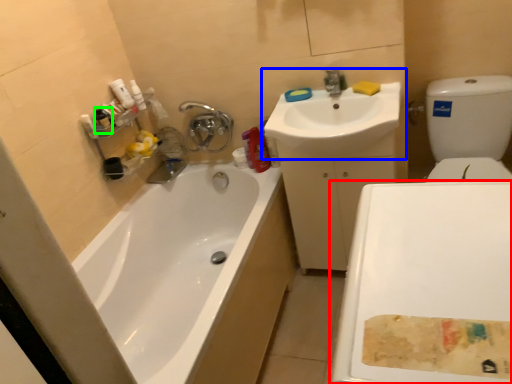
Question: Based on their relative distances, which object is farther from plain (highlighted by a red box)? Choose from sink (highlighted by a blue box) and mouthwash (highlighted by a green box).

Choices:
 (A) sink
 (B) mouthwash

Answer: (B)